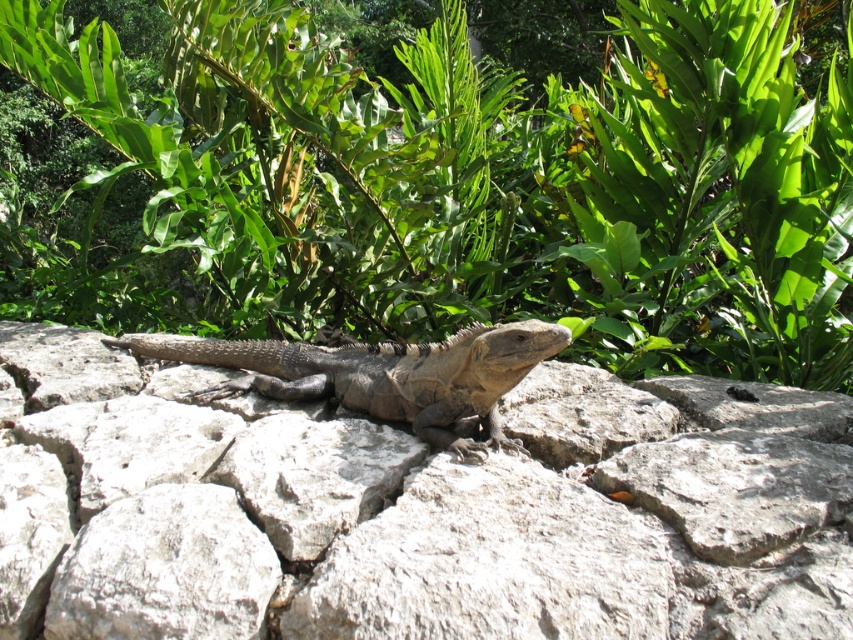
You are standing in the outdoor scene and want to locate both the green leafy plant at center and the leathery brown lizard at center. Which one is positioned to the right of the other?

The green leafy plant at center is to the right of the leathery brown lizard at center.

You are standing in the outdoor setting described. You see a point marked at coordinates (x=413, y=508). What object is located at that point?

The point at coordinates (x=413, y=508) marks the gray rough stone at center.

You are a hiker who wants to take a photo of the leathery brown lizard at center without disturbing it. Since the gray rough stone at center is its resting spot, where should you position yourself to avoid stepping on the stone?

The gray rough stone at center is positioned under the leathery brown lizard at center, so you should position yourself around the stone to avoid stepping on it while photographing the lizard.